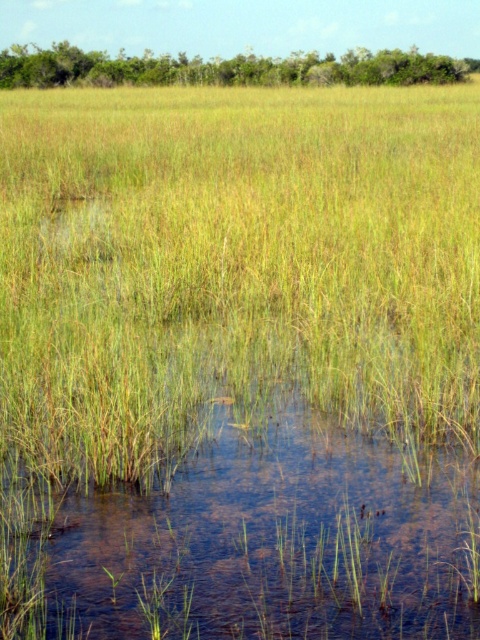
Is point (394, 470) farther from viewer compared to point (391, 74)?

No, it is not.

Is clear water at center shorter than green grass at upper center?

Correct, clear water at center is not as tall as green grass at upper center.

Locate an element on the screen. clear water at center is located at coordinates (263, 545).